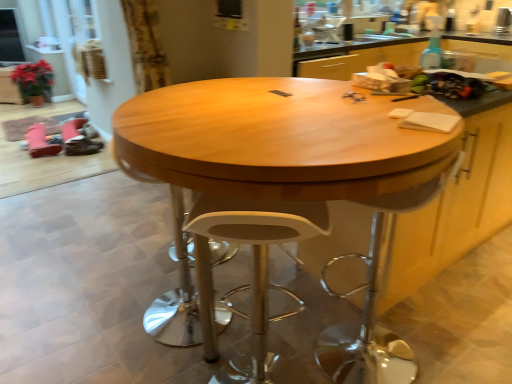
Question: Which is correct: green matte plant at left, the 2th cabinetry when ordered from front to back, is inside white plastic swivel chair at center, or outside of it?

Choices:
 (A) inside
 (B) outside

Answer: (B)

Question: Is green matte plant at left, which ranks as the 1th cabinetry in back-to-front order, wider or thinner than white plastic swivel chair at center?

Choices:
 (A) wide
 (B) thin

Answer: (A)

Question: Which of these objects is positioned farthest from the wooden table at center?

Choices:
 (A) green matte plant at left, marked as the second cabinetry in a right-to-left arrangement
 (B) white plastic stool at center
 (C) wooden cabinet at center, positioned as the second cabinetry in left-to-right order
 (D) white plastic swivel chair at center

Answer: (A)

Question: Estimate the real-world distances between objects in this image. Which object is farther from the wooden cabinet at center, which appears as the first cabinetry when viewed from the front?

Choices:
 (A) white plastic stool at center
 (B) white plastic swivel chair at center
 (C) green matte plant at left, the second cabinetry positioned from the bottom
 (D) wooden table at center

Answer: (C)